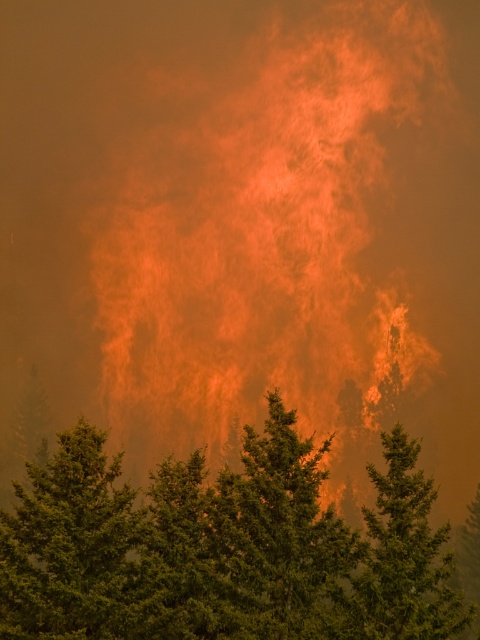
Between green textured tree at center and green textured pine tree at center, which one has more height?

With more height is green textured pine tree at center.

Does green textured tree at center have a greater width compared to green textured pine tree at center?

Yes.

Which is in front, point (323, 593) or point (369, 548)?

Point (369, 548) is more forward.

Identify the location of green textured tree at center. 224,548.

Which is in front, point (275, 436) or point (35, 579)?

Point (35, 579)

Who is more distant from viewer, (389, 554) or (120, 630)?

The point (389, 554) is more distant.

Is point (219, 572) positioned after point (88, 524)?

That is True.

Find the location of a particular element. green textured tree at center is located at coordinates (224, 548).

Is green textured tree at left shorter than green textured pine tree at center?

Indeed, green textured tree at left has a lesser height compared to green textured pine tree at center.

Between green textured tree at left and green textured pine tree at center, which one has more height?

Answer: green textured pine tree at center

What do you see at coordinates (70, 545) in the screenshot? I see `green textured tree at left` at bounding box center [70, 545].

Identify the location of green textured tree at left. This screenshot has height=640, width=480. (70, 545).